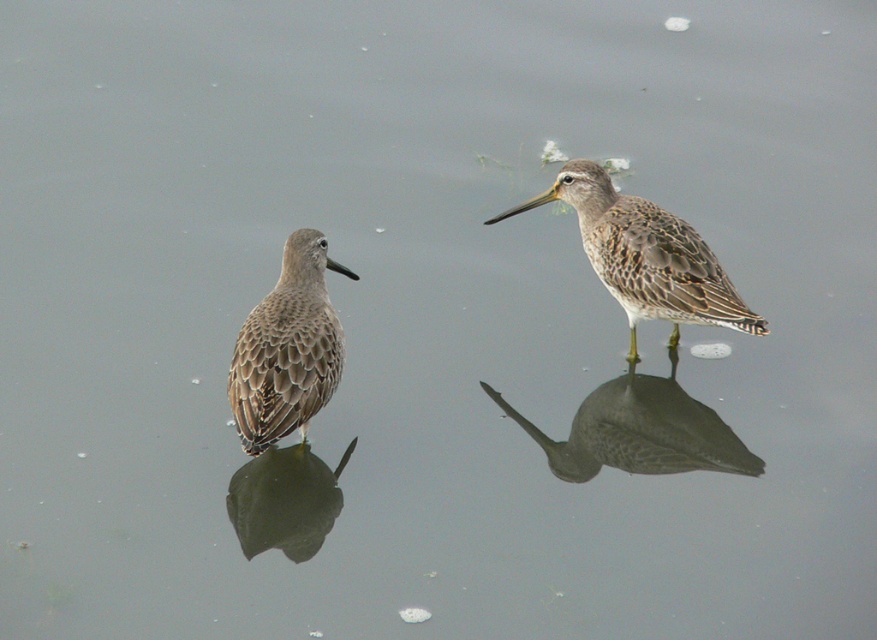
Is brown speckled sandpiper at right positioned before brown feathered bird at lower left?

No, brown speckled sandpiper at right is further to the viewer.

Locate an element on the screen. brown speckled sandpiper at right is located at coordinates (645, 256).

Identify the location of brown speckled sandpiper at right. (645, 256).

Is point (232, 378) closer to viewer compared to point (555, 467)?

Yes, point (232, 378) is closer to viewer.

Which is above, brown feathered bird at left or brown speckled bird at right?

brown feathered bird at left is above.

Image resolution: width=877 pixels, height=640 pixels. What do you see at coordinates (287, 348) in the screenshot?
I see `brown feathered bird at left` at bounding box center [287, 348].

This screenshot has width=877, height=640. I want to click on brown feathered bird at left, so click(x=287, y=348).

How distant is brown speckled bird at right from brown feathered bird at lower left?

brown speckled bird at right and brown feathered bird at lower left are 27.48 inches apart.

Identify the location of brown speckled bird at right. (639, 433).

Identify the location of brown speckled bird at right. The image size is (877, 640). (639, 433).